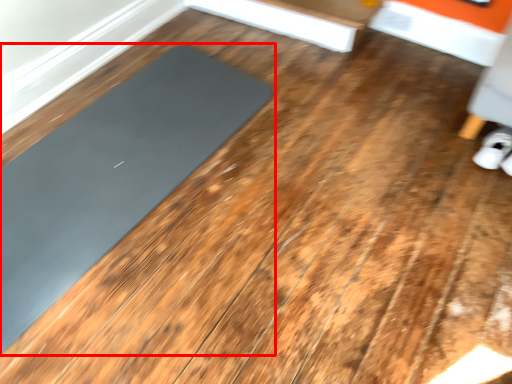
Question: Observing the image, what is the correct spatial positioning of mat (annotated by the red box) in reference to footwear?

Choices:
 (A) right
 (B) left

Answer: (B)